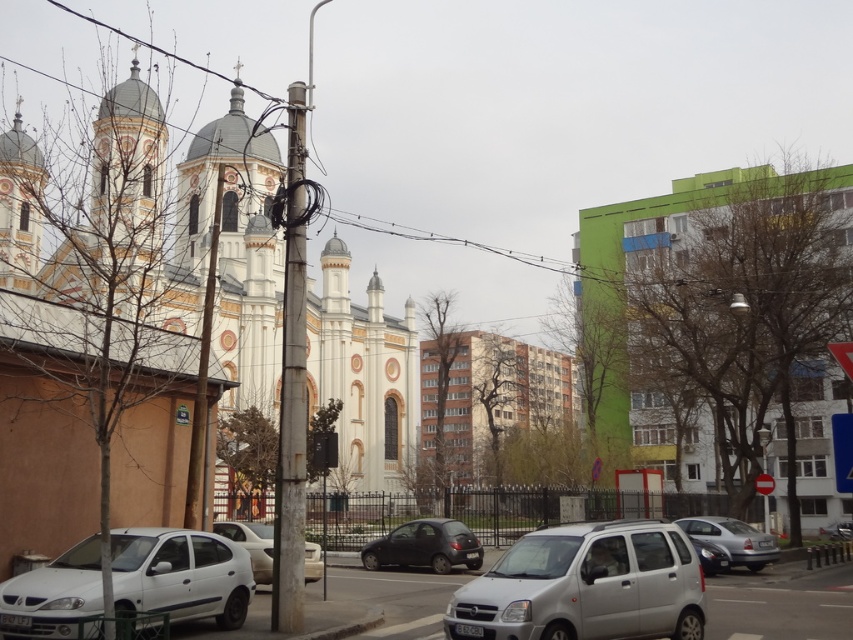
You are a delivery driver who needs to park your truck between the green matte building at right and the white matte car at lower left. Your truck is 6 meters long. Is there enough space between them to park your truck?

The distance between the green matte building at right and the white matte car at lower left is 61.65 meters, so yes, there is enough space to park the 6 meter long truck between them.

You are standing at the center of the street in front of the ornate building. You want to place a new streetlight exactly where the rusty metal pole at center is located. What are the coordinates of the spot where you should place the new streetlight?

The coordinates for the rusty metal pole at center are at point (291,385), so you should place the new streetlight at those coordinates.

You are a pedestrian standing at the edge of the street looking towards the ornate building. You see the rusty metal pole at center and the silver metallic hatchback at center. Which object is closer to the ornate building?

The rusty metal pole at center is to the left of the silver metallic hatchback at center. Since the ornate building is on the left side of the image, the rusty metal pole at center is closer to the ornate building.